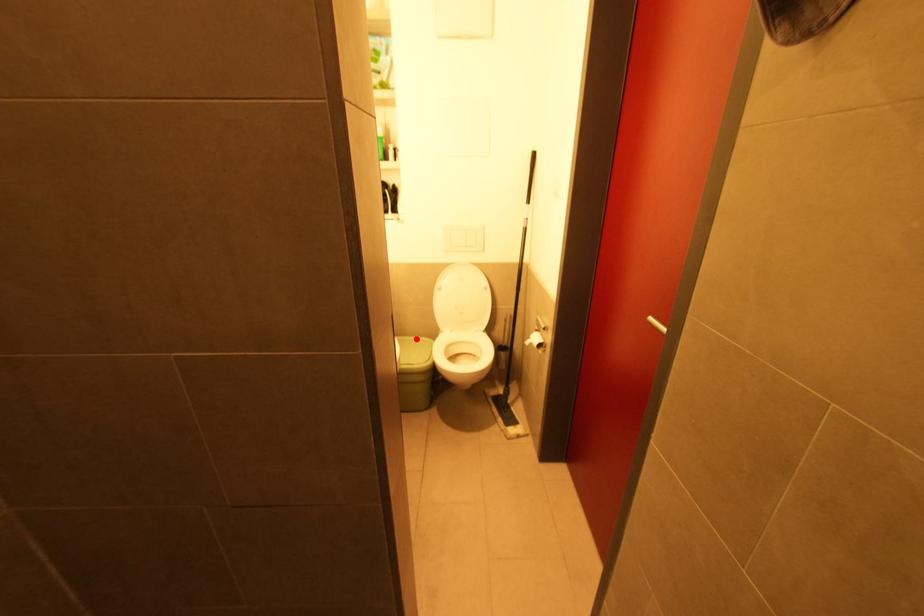
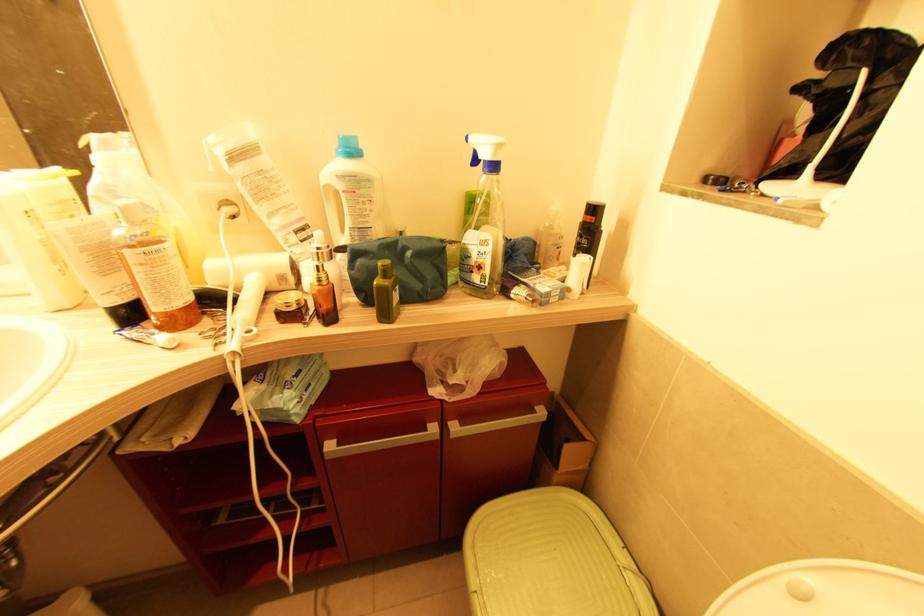
Question: I am providing you with two images of the same scene from different viewpoints. A red point is shown in image1. For the corresponding object point in image2, is it positioned nearer or farther from the camera?

Choices:
 (A) Nearer
 (B) Farther

Answer: (A)